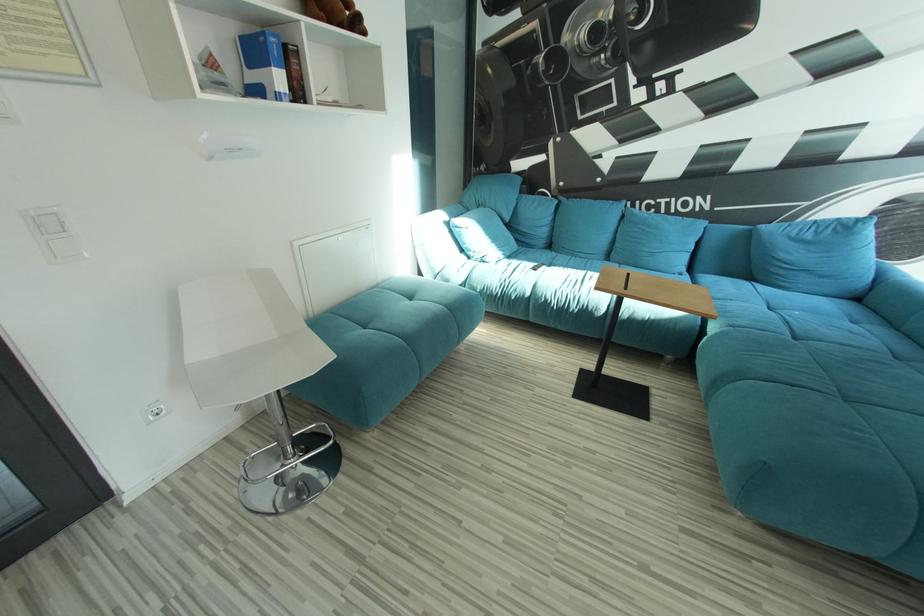
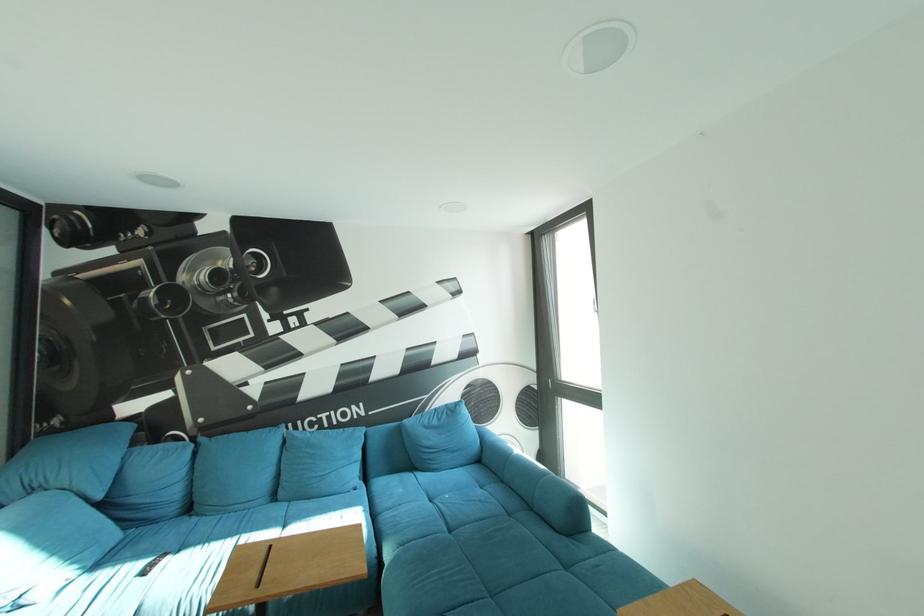
The images are taken continuously from a first-person perspective. In which direction is your viewpoint rotating?

The camera's rotation is toward right-up.